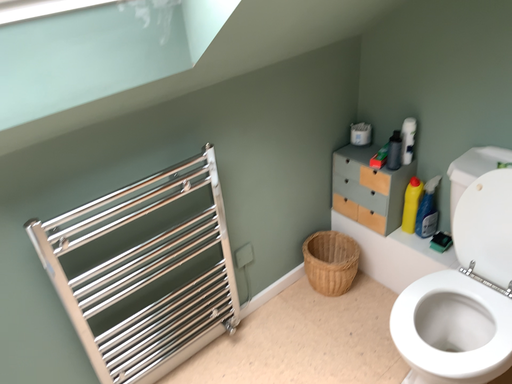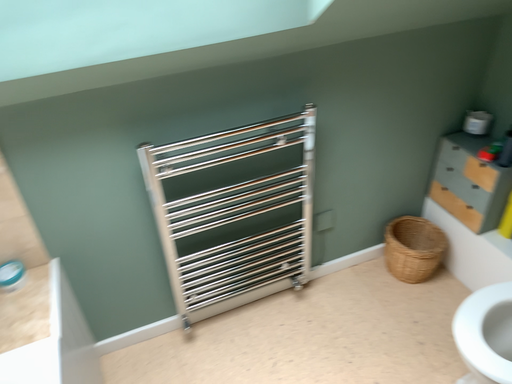
Question: How did the camera likely rotate when shooting the video?

Choices:
 (A) rotated left
 (B) rotated right

Answer: (A)